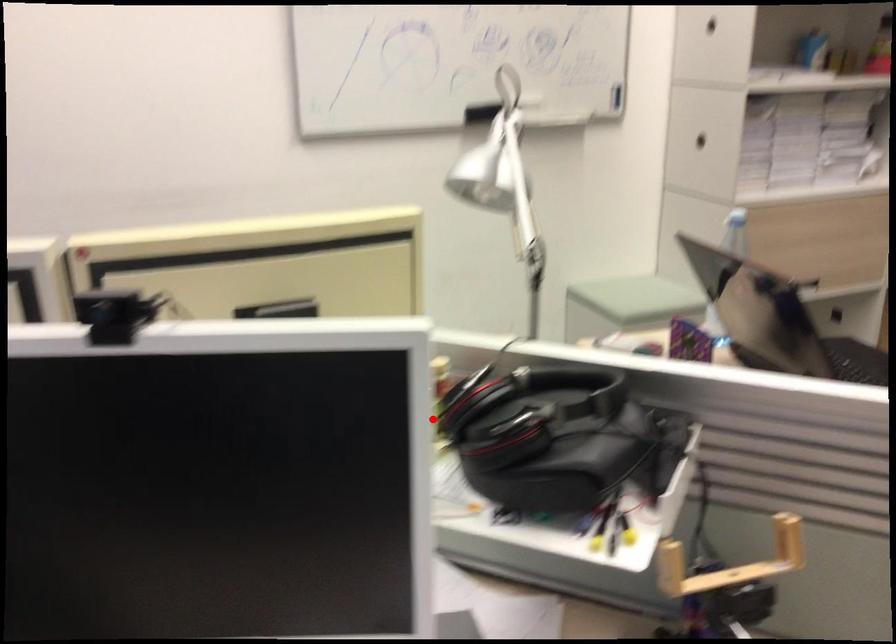
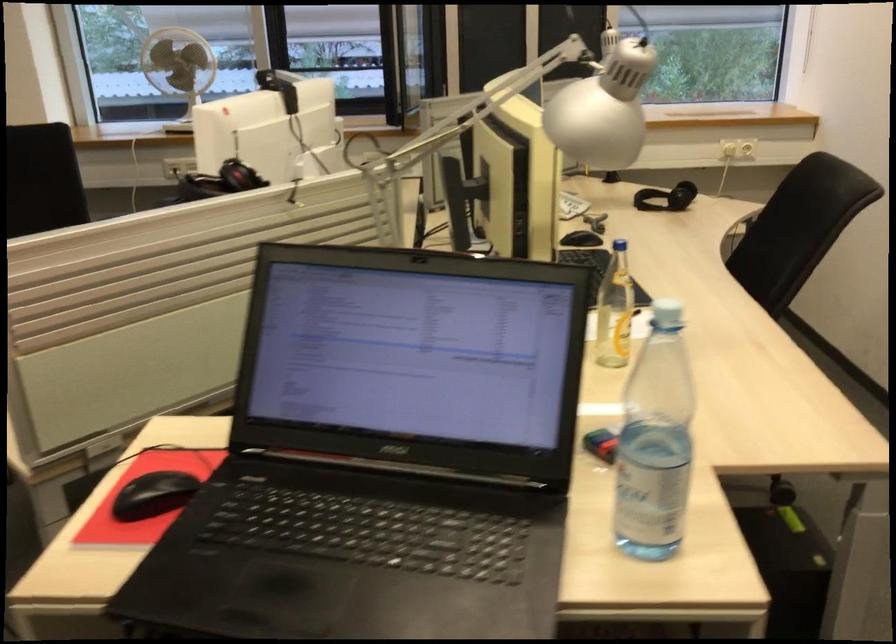
Question: I am providing you with two images of the same scene from different viewpoints. A red point is shown in image1. For the corresponding object point in image2, is it positioned nearer or farther from the camera?

Choices:
 (A) Nearer
 (B) Farther

Answer: (B)